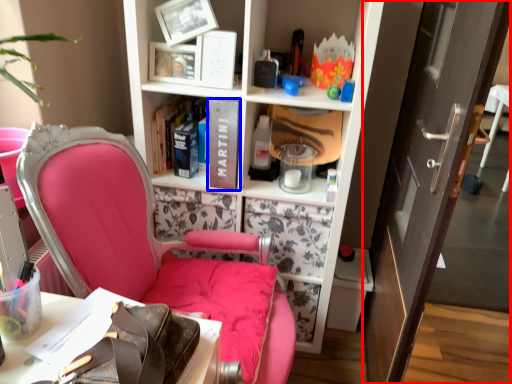
Question: Which object appears closest to the camera in this image, door (highlighted by a red box) or book (highlighted by a blue box)?

Choices:
 (A) door
 (B) book

Answer: (A)